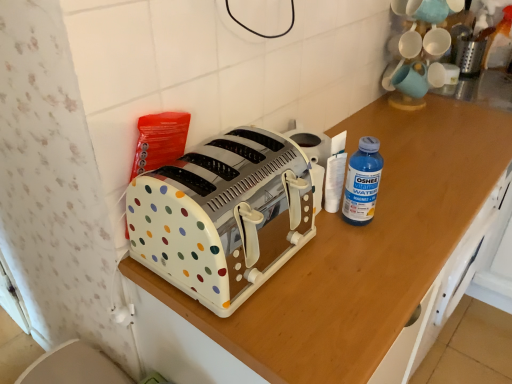
Question: Is white polka dot plastic toaster at center thinner than metallic silver grater at upper right?

Choices:
 (A) yes
 (B) no

Answer: (B)

Question: Is white polka dot plastic toaster at center to the right of metallic silver grater at upper right from the viewer's perspective?

Choices:
 (A) yes
 (B) no

Answer: (B)

Question: Would you say white polka dot plastic toaster at center is outside metallic silver grater at upper right?

Choices:
 (A) no
 (B) yes

Answer: (B)

Question: From a real-world perspective, does white polka dot plastic toaster at center sit lower than metallic silver grater at upper right?

Choices:
 (A) yes
 (B) no

Answer: (B)

Question: Is white polka dot plastic toaster at center further to camera compared to metallic silver grater at upper right?

Choices:
 (A) no
 (B) yes

Answer: (A)

Question: Looking at their shapes, would you say white plastic toaster at center is wider or thinner than metallic silver grater at upper right?

Choices:
 (A) thin
 (B) wide

Answer: (B)

Question: Looking at the image, does white plastic toaster at center seem bigger or smaller compared to metallic silver grater at upper right?

Choices:
 (A) small
 (B) big

Answer: (B)

Question: Is white plastic toaster at center situated inside metallic silver grater at upper right or outside?

Choices:
 (A) inside
 (B) outside

Answer: (B)

Question: Is point (389, 249) closer or farther from the camera than point (480, 59)?

Choices:
 (A) closer
 (B) farther

Answer: (A)

Question: Is blue plastic bottle at right bigger or smaller than metallic silver grater at upper right?

Choices:
 (A) small
 (B) big

Answer: (A)

Question: From a real-world perspective, is blue plastic bottle at right above or below metallic silver grater at upper right?

Choices:
 (A) below
 (B) above

Answer: (B)

Question: Looking at their shapes, would you say blue plastic bottle at right is wider or thinner than metallic silver grater at upper right?

Choices:
 (A) thin
 (B) wide

Answer: (A)

Question: From the image's perspective, is blue plastic bottle at right located above or below metallic silver grater at upper right?

Choices:
 (A) below
 (B) above

Answer: (A)

Question: Considering the relative positions of blue plastic bottle at right and white polka dot plastic toaster at center in the image provided, is blue plastic bottle at right to the left or to the right of white polka dot plastic toaster at center?

Choices:
 (A) right
 (B) left

Answer: (A)

Question: From the image's perspective, relative to white polka dot plastic toaster at center, is blue plastic bottle at right above or below?

Choices:
 (A) below
 (B) above

Answer: (B)